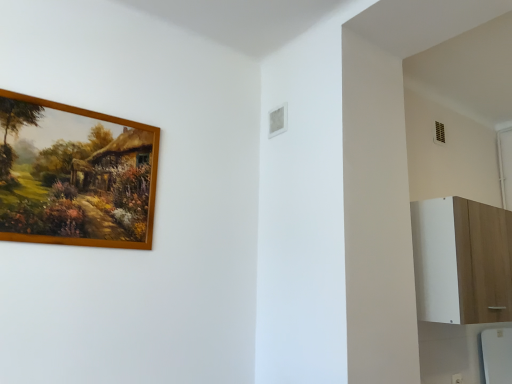
What do you see at coordinates (462, 261) in the screenshot? This screenshot has width=512, height=384. I see `white wood cabinet at right` at bounding box center [462, 261].

The width and height of the screenshot is (512, 384). What are the coordinates of `white wood cabinet at right` in the screenshot? It's located at (462, 261).

In order to face white wood cabinet at right, should I rotate leftwards or rightwards?

Rotate right and turn 28.988 degrees.

Image resolution: width=512 pixels, height=384 pixels. Describe the element at coordinates (75, 175) in the screenshot. I see `wooden picture frame at upper left` at that location.

You are a GUI agent. You are given a task and a screenshot of the screen. Output one action in this format:
    pyautogui.click(x=<x>, y=<y>)
    Task: Click on the wooden picture frame at upper left
    
    Given the screenshot: What is the action you would take?
    pyautogui.click(x=75, y=175)

You are a GUI agent. You are given a task and a screenshot of the screen. Output one action in this format:
    pyautogui.click(x=<x>, y=<y>)
    Task: Click on the white wood cabinet at right
    The height and width of the screenshot is (384, 512).
    Given the screenshot: What is the action you would take?
    pyautogui.click(x=462, y=261)

Is wooden picture frame at upper left at the left side of white wood cabinet at right?

Indeed, wooden picture frame at upper left is positioned on the left side of white wood cabinet at right.

Which object is closer to the camera taking this photo, wooden picture frame at upper left or white wood cabinet at right?

wooden picture frame at upper left is closer to the camera.

Which is less distant, (157, 129) or (511, 269)?

The point (157, 129) is closer to the camera.

From the image's perspective, is wooden picture frame at upper left beneath white wood cabinet at right?

Incorrect, from the image's perspective, wooden picture frame at upper left is higher than white wood cabinet at right.

From a real-world perspective, is wooden picture frame at upper left beneath white wood cabinet at right?

No.

Can you confirm if wooden picture frame at upper left is thinner than white wood cabinet at right?

Yes.

Can you confirm if wooden picture frame at upper left is taller than white wood cabinet at right?

No, wooden picture frame at upper left is not taller than white wood cabinet at right.

In terms of size, does wooden picture frame at upper left appear bigger or smaller than white wood cabinet at right?

In the image, wooden picture frame at upper left appears to be smaller than white wood cabinet at right.

Is white wood cabinet at right surrounded by wooden picture frame at upper left?

Definitely not — white wood cabinet at right is not inside wooden picture frame at upper left.

Are wooden picture frame at upper left and white wood cabinet at right beside each other?

wooden picture frame at upper left and white wood cabinet at right are not in contact.

Could you tell me if wooden picture frame at upper left is turned towards white wood cabinet at right?

No, wooden picture frame at upper left is not turned towards white wood cabinet at right.

How much distance is there between wooden picture frame at upper left and white wood cabinet at right?

A distance of 1.50 meters exists between wooden picture frame at upper left and white wood cabinet at right.

Identify the location of picture frame on the left of white wood cabinet at right. (75, 175).

Considering the positions of objects white wood cabinet at right and wooden picture frame at upper left in the image provided, who is more to the left, white wood cabinet at right or wooden picture frame at upper left?

From the viewer's perspective, wooden picture frame at upper left appears more on the left side.

Relative to wooden picture frame at upper left, is white wood cabinet at right in front or behind?

white wood cabinet at right is behind wooden picture frame at upper left.

Is point (476, 223) closer or farther from the camera than point (154, 137)?

Point (476, 223) is farther from the camera than point (154, 137).

From the image's perspective, is white wood cabinet at right located beneath wooden picture frame at upper left?

Yes, from the image's perspective, white wood cabinet at right is below wooden picture frame at upper left.

From a real-world perspective, is white wood cabinet at right positioned above or below wooden picture frame at upper left?

From a real-world perspective, white wood cabinet at right is physically below wooden picture frame at upper left.

Which of these two, white wood cabinet at right or wooden picture frame at upper left, is wider?

white wood cabinet at right is wider.

Considering the relative sizes of white wood cabinet at right and wooden picture frame at upper left in the image provided, is white wood cabinet at right shorter than wooden picture frame at upper left?

No.

Considering the sizes of objects white wood cabinet at right and wooden picture frame at upper left in the image provided, who is smaller, white wood cabinet at right or wooden picture frame at upper left?

Smaller between the two is wooden picture frame at upper left.

Is white wood cabinet at right surrounding wooden picture frame at upper left?

No, wooden picture frame at upper left is located outside of white wood cabinet at right.

Is white wood cabinet at right in contact with wooden picture frame at upper left?

No, white wood cabinet at right is not next to wooden picture frame at upper left.

Could you tell me if white wood cabinet at right is facing wooden picture frame at upper left?

No.

You are a GUI agent. You are given a task and a screenshot of the screen. Output one action in this format:
    pyautogui.click(x=<x>, y=<y>)
    Task: Click on the picture frame on the left of the white wood cabinet at right
    The width and height of the screenshot is (512, 384).
    Given the screenshot: What is the action you would take?
    pyautogui.click(x=75, y=175)

Where is `dresser lying on the right of wooden picture frame at upper left`? This screenshot has width=512, height=384. dresser lying on the right of wooden picture frame at upper left is located at coordinates (462, 261).

Locate an element on the screen. dresser below the wooden picture frame at upper left (from a real-world perspective) is located at coordinates (462, 261).